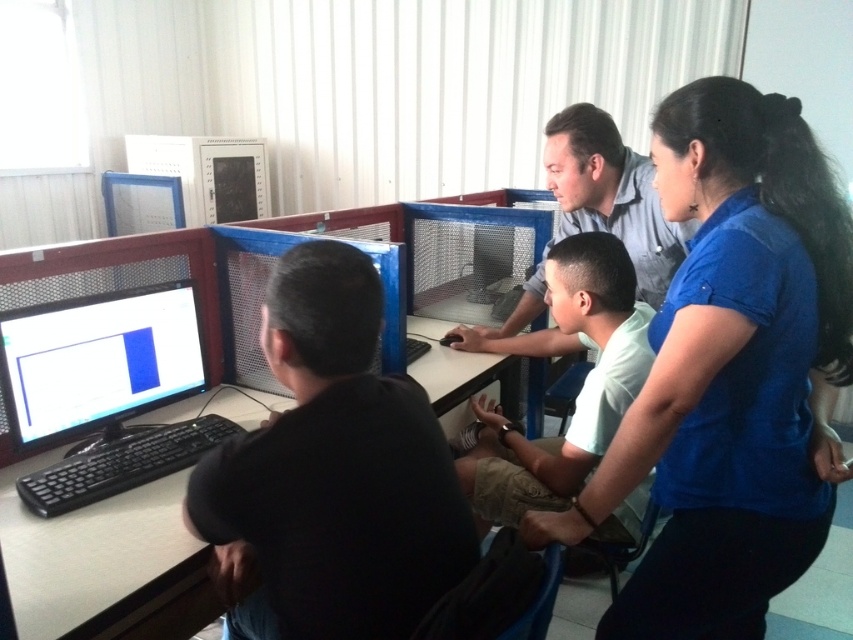
Looking at this image, you are standing at the entrance of the office and see two items at the left side of the desk. One is the black matte shirt at left and the other is the matte black monitor at left. Which one is positioned more to the right?

The black matte shirt at left is positioned more to the right than the matte black monitor at left.

You are standing in the office and need to hand a document to the person wearing the blue fabric shirt at upper right. Since you can only reach up to shoulder height, will you be able to reach them if the black matte shirt at left is blocking your path?

The blue fabric shirt at upper right is positioned over the black matte shirt at left, meaning the blue fabric shirt at upper right is closer to you. Since you can reach up to shoulder height and the blue fabric shirt at upper right is not blocked by the black matte shirt at left, you can reach them.

You are standing at the computer workstation in the office. You see two points marked on the desk surface, one at point (784, 472) and another at point (239, 634). Which point is closer to you?

Point (784, 472) is in front of point (239, 634), so it is closer to you.